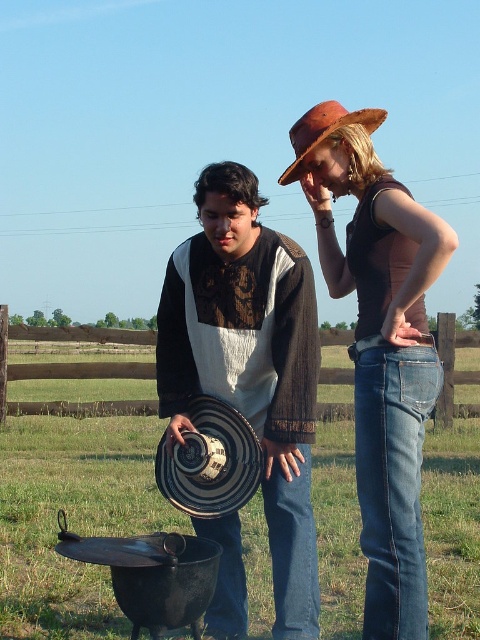
Between striped straw hat at center and denim jeans at center, which one is positioned higher?

denim jeans at center is above.

Identify the location of striped straw hat at center. (250, 364).

The image size is (480, 640). Identify the location of striped straw hat at center. (250, 364).

Who is shorter, striped straw hat at center or brown straw hat at upper center?

With less height is striped straw hat at center.

Locate an element on the screen. striped straw hat at center is located at coordinates (250, 364).

The width and height of the screenshot is (480, 640). Find the location of `striped straw hat at center`. striped straw hat at center is located at coordinates (250, 364).

Is point (420, 250) behind point (300, 163)?

No, (420, 250) is closer to viewer.

Does denim jeans at center come in front of brown straw hat at upper center?

Yes, it is in front of brown straw hat at upper center.

Who is more forward, [405,476] or [290,140]?

Point [405,476] is more forward.

Where is `denim jeans at center`? This screenshot has height=640, width=480. denim jeans at center is located at coordinates (380, 344).